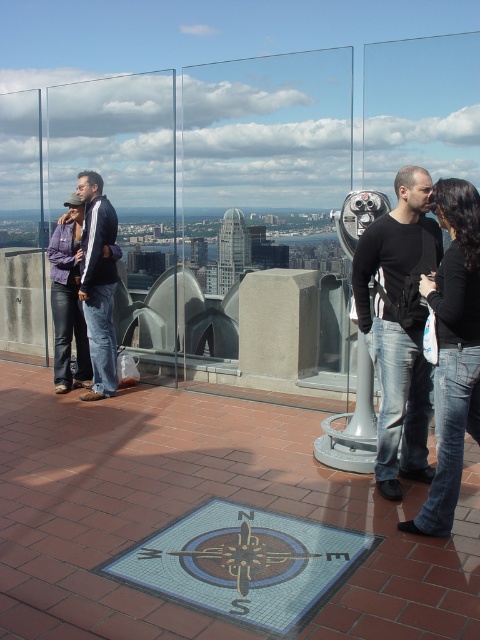
You are standing on the rooftop observation deck and notice two people wearing black matte clothing. One is wearing black matte jeans at right and the other is wearing a matte black jacket at left. Based on their positions, which clothing item is positioned further to the east?

The black matte jeans at right are positioned further to the east since they are to the right of the matte black jacket at left, and the compass indicates east is to the right side of the deck.

You are standing on the rooftop observation deck and notice two people wearing black matte clothing. One is wearing a black matte shirt at center and the other a matte black jacket at left. From your perspective, which person is standing to the left of the other?

The matte black jacket at left is positioned to the left of the black matte shirt at center.

You are standing at the point marked as point [359,317] on the rooftop observation deck. You want to take a photo of the city skyline without anyone blocking your view. The camera is 3.70 meters away from you. In which direction should you move to ensure the camera is unobstructed by the people around?

You should move towards the camera, which is 3.70 meters away from point [359,317]. Moving directly toward the camera will place you closer to it, reducing the distance and potentially allowing you to position yourself where there are fewer people obstructing the view.